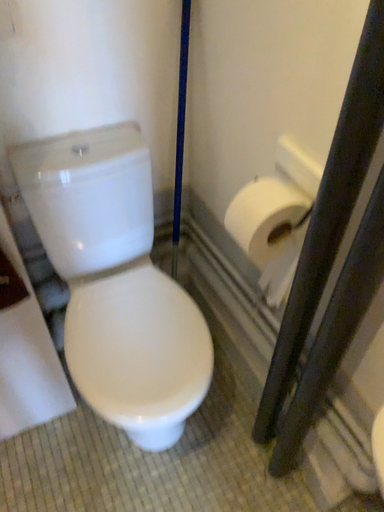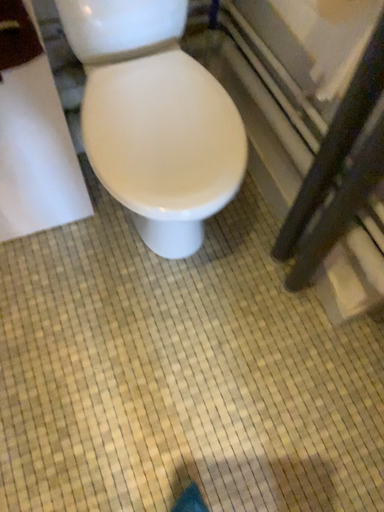
Question: Which way did the camera rotate in the video?

Choices:
 (A) rotated upward
 (B) rotated downward

Answer: (B)